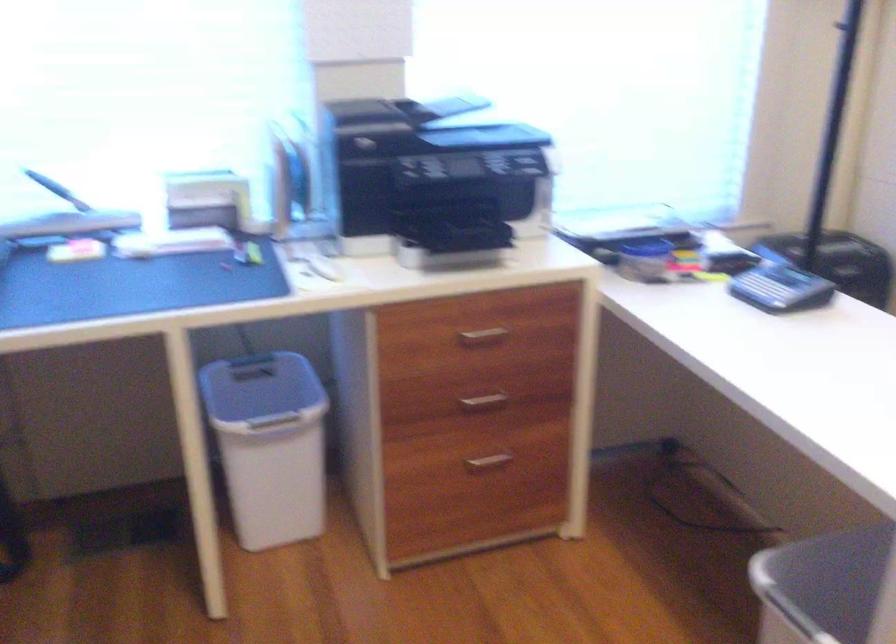
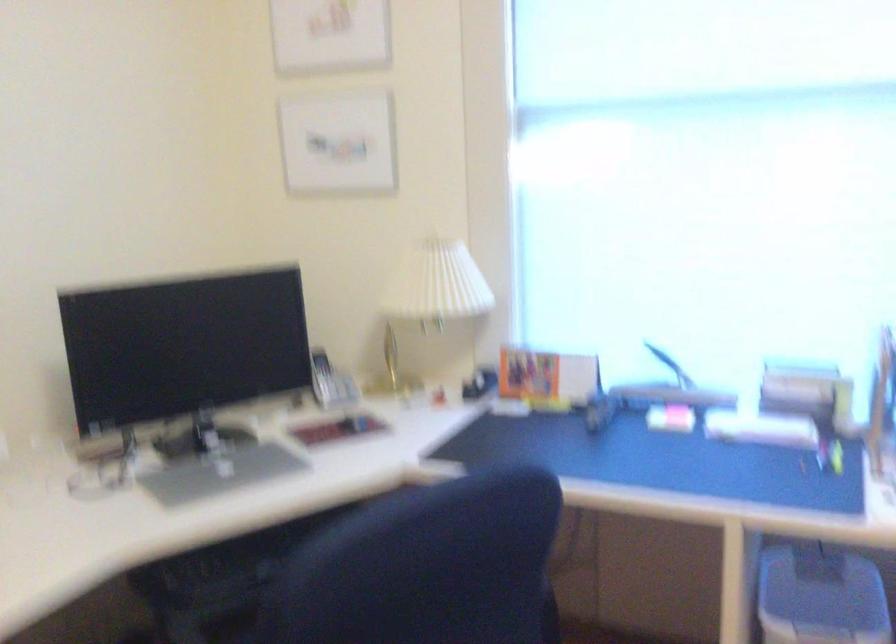
Where in the second image is the point corresponding to pixel 254 389 from the first image?

(821, 596)